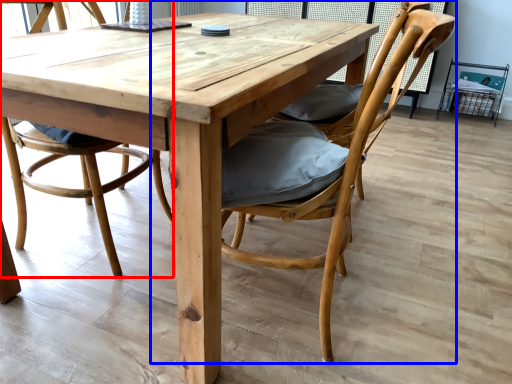
Question: Among these objects, which one is farthest to the camera, chair (highlighted by a red box) or chair (highlighted by a blue box)?

Choices:
 (A) chair
 (B) chair

Answer: (A)